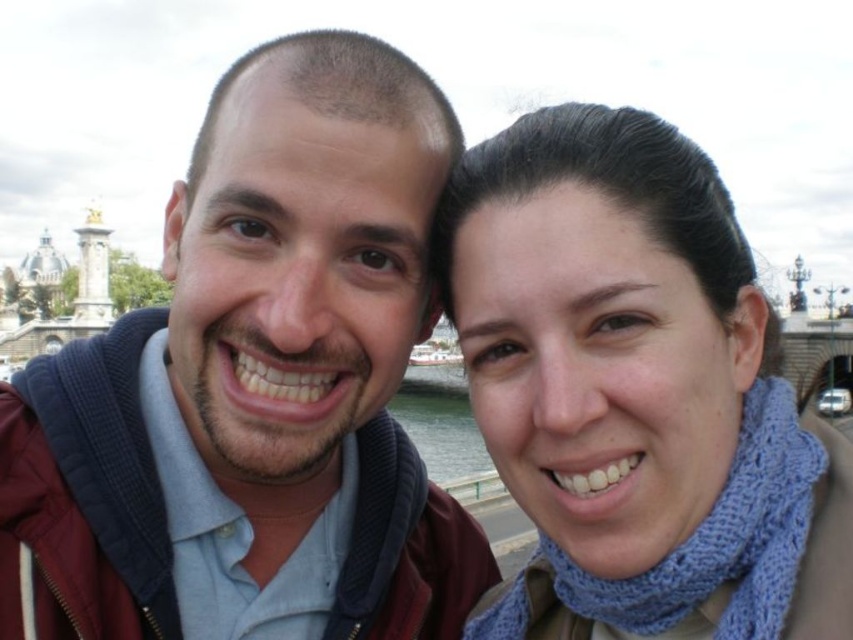
Question: Which object is positioned closest to the clear water at lower center?

Choices:
 (A) matte blue sweater at center
 (B) blue knitted scarf at upper right

Answer: (A)

Question: Does matte blue sweater at center appear on the right side of clear water at lower center?

Choices:
 (A) no
 (B) yes

Answer: (A)

Question: Among these points, which one is nearest to the camera?

Choices:
 (A) (457, 464)
 (B) (500, 337)

Answer: (B)

Question: Is matte blue sweater at center bigger than clear water at lower center?

Choices:
 (A) no
 (B) yes

Answer: (B)

Question: Which point is closer to the camera?

Choices:
 (A) clear water at lower center
 (B) blue knitted scarf at upper right
 (C) matte blue sweater at center

Answer: (B)

Question: Is matte blue sweater at center smaller than blue knitted scarf at upper right?

Choices:
 (A) yes
 (B) no

Answer: (B)